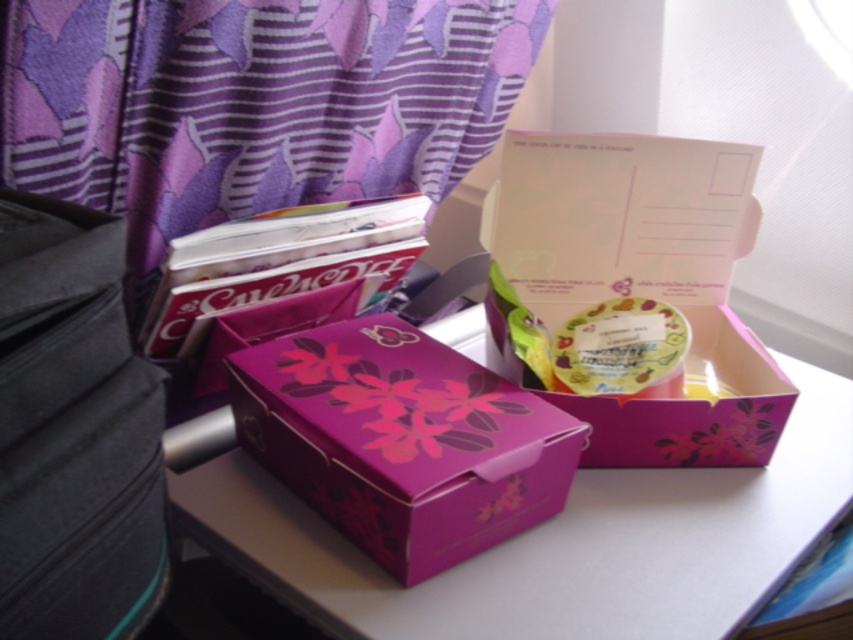
Is purple cardboard box at center further to the viewer compared to black fabric bag at left?

Yes, purple cardboard box at center is further from the viewer.

Who is higher up, purple cardboard box at center or black fabric bag at left?

black fabric bag at left is higher up.

Which is in front, point (477, 349) or point (138, 480)?

Positioned in front is point (138, 480).

Find the location of a particular element. The width and height of the screenshot is (853, 640). purple cardboard box at center is located at coordinates pyautogui.click(x=560, y=541).

Which is behind, point (99, 305) or point (469, 362)?

Point (469, 362)

Which is in front, point (84, 444) or point (486, 448)?

Positioned in front is point (84, 444).

The height and width of the screenshot is (640, 853). I want to click on black fabric bag at left, so pos(73,429).

Is point (38, 10) positioned in front of point (730, 536)?

Yes, point (38, 10) is in front of point (730, 536).

Is purple fabric curtain at upper left to the right of purple cardboard box at center from the viewer's perspective?

Incorrect, purple fabric curtain at upper left is not on the right side of purple cardboard box at center.

Consider the image. Who is more distant from viewer, (224, 198) or (224, 456)?

Positioned behind is point (224, 198).

Locate an element on the screen. The width and height of the screenshot is (853, 640). purple fabric curtain at upper left is located at coordinates (251, 104).